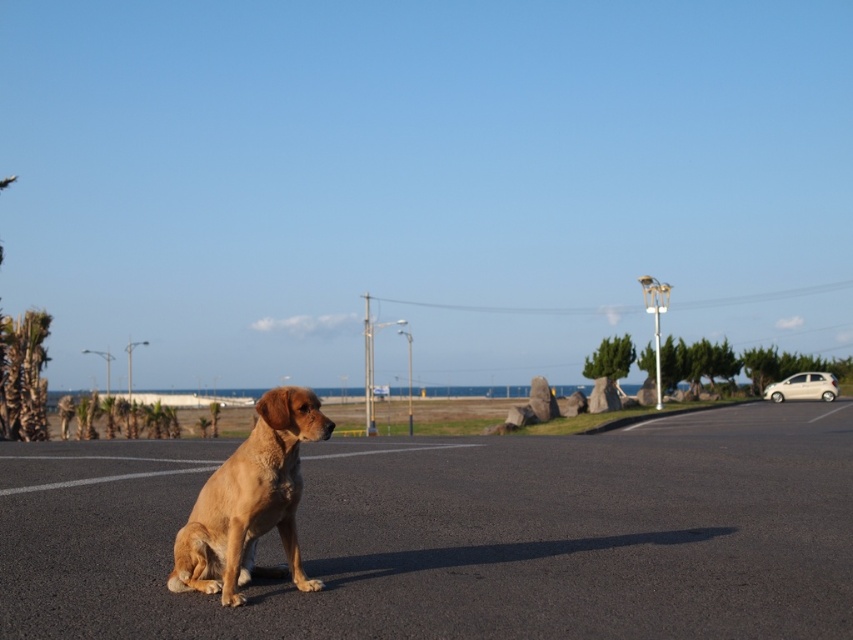
You are driving a beige glossy hatchback at right and want to park it on the paved road where the golden fur dog at center is sitting. Is there enough space to park the car without moving the dog?

The golden fur dog at center has a smaller size compared to the beige glossy hatchback at right, so there should be enough space to park the car without moving the dog since the dog takes up less area on the road.

You are a drone operator who needs to fly a drone from the green leafy palm tree at left to the beige glossy hatchback at right. The drone has a maximum range of 40 meters. Can the drone complete the flight without needing a recharge?

→ The green leafy palm tree at left and beige glossy hatchback at right are 39.83 meters apart. Since the distance is less than the drone maximum range of 40 meters, the drone can complete the flight without needing a recharge.

In the scene shown: You are a photographer wanting to capture the green leafy palm tree at left and the beige glossy hatchback at right in the same frame. Based on their heights, which object should you position closer to the camera to ensure both are fully visible?

The green leafy palm tree at left is taller than the beige glossy hatchback at right. To ensure both are fully visible, position the taller palm tree closer to the camera so its height doesn not exceed the frame while the shorter hatchback can be seen in the background.